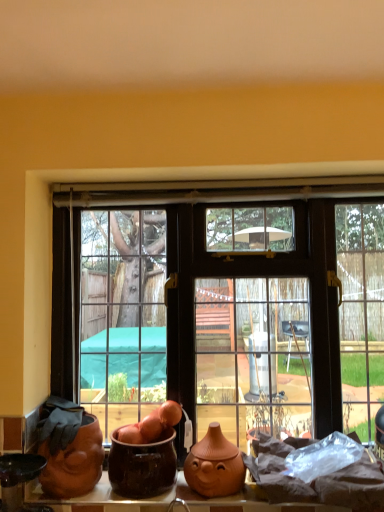
Measure the distance between point (146,446) and camera.

The depth of point (146,446) is 4.24 feet.

What do you see at coordinates (214, 465) in the screenshot? I see `matte orange clay vase at center, which appears as the 1th pottery when viewed from the right` at bounding box center [214, 465].

Identify the location of matte orange clay vase at center, which appears as the 1th pottery when viewed from the right. (214, 465).

The width and height of the screenshot is (384, 512). Identify the location of matte glass window at center. (235, 312).

From a real-world perspective, who is located lower, brown glazed pot at center, positioned as the 2th pottery in left-to-right order, or matte terracotta pot at lower left, which appears as the 1th pottery when viewed from the left?

In real-world perspective, brown glazed pot at center, positioned as the 2th pottery in left-to-right order, is lower.

Is point (160, 450) farther from camera compared to point (46, 468)?

Yes, point (160, 450) is behind point (46, 468).

Considering the relative sizes of brown glazed pot at center, the 2th pottery when ordered from right to left, and matte terracotta pot at lower left, arranged as the third pottery when viewed from the right, in the image provided, is brown glazed pot at center, the 2th pottery when ordered from right to left, thinner than matte terracotta pot at lower left, arranged as the third pottery when viewed from the right,?

Yes.

Consider the image. Which is farther, (194, 482) or (176, 210)?

The point (176, 210) is farther.

Between matte orange clay vase at center, the third pottery when ordered from left to right, and matte glass window at center, which one appears on the left side from the viewer's perspective?

matte orange clay vase at center, the third pottery when ordered from left to right.

Would you say matte orange clay vase at center, the third pottery when ordered from left to right, is outside matte glass window at center?

Absolutely, matte orange clay vase at center, the third pottery when ordered from left to right, is external to matte glass window at center.

Is matte terracotta pot at lower left, which appears as the 1th pottery when viewed from the left, shorter than matte glass window at center?

Yes.

From the image's perspective, between matte terracotta pot at lower left, which appears as the 1th pottery when viewed from the left, and matte glass window at center, who is located below?

matte terracotta pot at lower left, which appears as the 1th pottery when viewed from the left, from the image's perspective.

Does point (45, 444) come in front of point (357, 406)?

Yes, it is in front of point (357, 406).

In terms of size, does matte terracotta pot at lower left, arranged as the third pottery when viewed from the right, appear bigger or smaller than matte glass window at center?

matte terracotta pot at lower left, arranged as the third pottery when viewed from the right, is smaller than matte glass window at center.

Is brown glazed pot at center, positioned as the 2th pottery in left-to-right order, at the back of matte terracotta pot at lower left, arranged as the third pottery when viewed from the right?

No, matte terracotta pot at lower left, arranged as the third pottery when viewed from the right, is not facing the opposite direction of brown glazed pot at center, positioned as the 2th pottery in left-to-right order.

Which object is wider, matte terracotta pot at lower left, arranged as the third pottery when viewed from the right, or brown glazed pot at center, positioned as the 2th pottery in left-to-right order?

With larger width is matte terracotta pot at lower left, arranged as the third pottery when viewed from the right.

You are a GUI agent. You are given a task and a screenshot of the screen. Output one action in this format:
    pyautogui.click(x=<x>, y=<y>)
    Task: Click on the pottery that is in front of the matte terracotta pot at lower left, which appears as the 1th pottery when viewed from the left
    
    Given the screenshot: What is the action you would take?
    [143, 466]

Based on the photo, is matte terracotta pot at lower left, which appears as the 1th pottery when viewed from the left, placed right next to brown glazed pot at center, the 2th pottery when ordered from right to left?

No, matte terracotta pot at lower left, which appears as the 1th pottery when viewed from the left, is not beside brown glazed pot at center, the 2th pottery when ordered from right to left.

Consider the image. Is matte glass window at center looking in the opposite direction of brown glazed pot at center, positioned as the 2th pottery in left-to-right order?

Yes, brown glazed pot at center, positioned as the 2th pottery in left-to-right order, is at the back of matte glass window at center.

Considering the positions of objects matte glass window at center and brown glazed pot at center, positioned as the 2th pottery in left-to-right order, in the image provided, who is more to the right, matte glass window at center or brown glazed pot at center, positioned as the 2th pottery in left-to-right order,?

matte glass window at center is more to the right.

Is matte glass window at center in front of or behind brown glazed pot at center, the 2th pottery when ordered from right to left, in the image?

In the image, matte glass window at center appears behind brown glazed pot at center, the 2th pottery when ordered from right to left.

From a real-world perspective, which is physically below, matte glass window at center or brown glazed pot at center, the 2th pottery when ordered from right to left?

brown glazed pot at center, the 2th pottery when ordered from right to left, is physically lower.

You are a GUI agent. You are given a task and a screenshot of the screen. Output one action in this format:
    pyautogui.click(x=<x>, y=<y>)
    Task: Click on the 3rd pottery to the left of the matte glass window at center, starting your count from the anchor
    Image resolution: width=384 pixels, height=512 pixels.
    Given the screenshot: What is the action you would take?
    pyautogui.click(x=74, y=462)

Which object is further away from the camera taking this photo, matte glass window at center or matte terracotta pot at lower left, arranged as the third pottery when viewed from the right?

matte glass window at center is further away from the camera.

Does matte glass window at center have a larger size compared to matte terracotta pot at lower left, arranged as the third pottery when viewed from the right?

Indeed, matte glass window at center has a larger size compared to matte terracotta pot at lower left, arranged as the third pottery when viewed from the right.

Could you measure the distance between matte glass window at center and matte terracotta pot at lower left, which appears as the 1th pottery when viewed from the left?

The distance of matte glass window at center from matte terracotta pot at lower left, which appears as the 1th pottery when viewed from the left, is 3.76 meters.

Is brown glazed pot at center, the 2th pottery when ordered from right to left, not within matte orange clay vase at center, the third pottery when ordered from left to right?

brown glazed pot at center, the 2th pottery when ordered from right to left, lies outside matte orange clay vase at center, the third pottery when ordered from left to right,'s area.

Is brown glazed pot at center, the 2th pottery when ordered from right to left, taller than matte orange clay vase at center, which appears as the 1th pottery when viewed from the right?

Correct, brown glazed pot at center, the 2th pottery when ordered from right to left, is much taller as matte orange clay vase at center, which appears as the 1th pottery when viewed from the right.

From the image's perspective, which is above, brown glazed pot at center, the 2th pottery when ordered from right to left, or matte orange clay vase at center, which appears as the 1th pottery when viewed from the right?

brown glazed pot at center, the 2th pottery when ordered from right to left, is shown above in the image.

In the scene shown: Could you tell me if brown glazed pot at center, positioned as the 2th pottery in left-to-right order, is facing matte orange clay vase at center, which appears as the 1th pottery when viewed from the right?

No, brown glazed pot at center, positioned as the 2th pottery in left-to-right order, is not oriented towards matte orange clay vase at center, which appears as the 1th pottery when viewed from the right.

At what (x,y) coordinates should I click in order to perform the action: click on pottery that appears in front of the matte terracotta pot at lower left, arranged as the third pottery when viewed from the right. Please return your answer as a coordinate pair (x, y). This screenshot has width=384, height=512. Looking at the image, I should click on (143, 466).

You are a GUI agent. You are given a task and a screenshot of the screen. Output one action in this format:
    pyautogui.click(x=<x>, y=<y>)
    Task: Click on the window on the right of matte orange clay vase at center, the third pottery when ordered from left to right
    The height and width of the screenshot is (512, 384).
    Given the screenshot: What is the action you would take?
    coord(235,312)

Estimate the real-world distances between objects in this image. Which object is further from matte orange clay vase at center, which appears as the 1th pottery when viewed from the right, matte glass window at center or brown glazed pot at center, the 2th pottery when ordered from right to left?

matte glass window at center is further to matte orange clay vase at center, which appears as the 1th pottery when viewed from the right.

Based on their spatial positions, is matte glass window at center or matte terracotta pot at lower left, which appears as the 1th pottery when viewed from the left, further from matte orange clay vase at center, which appears as the 1th pottery when viewed from the right?

Based on the image, matte glass window at center appears to be further to matte orange clay vase at center, which appears as the 1th pottery when viewed from the right.

Estimate the real-world distances between objects in this image. Which object is further from matte orange clay vase at center, the third pottery when ordered from left to right, matte terracotta pot at lower left, arranged as the third pottery when viewed from the right, or matte glass window at center?

matte glass window at center is further to matte orange clay vase at center, the third pottery when ordered from left to right.

From the image, which object appears to be farther from matte orange clay vase at center, which appears as the 1th pottery when viewed from the right, brown glazed pot at center, the 2th pottery when ordered from right to left, or matte terracotta pot at lower left, which appears as the 1th pottery when viewed from the left?

matte terracotta pot at lower left, which appears as the 1th pottery when viewed from the left, lies further to matte orange clay vase at center, which appears as the 1th pottery when viewed from the right, than the other object.

Which object lies nearer to the anchor point matte glass window at center, matte orange clay vase at center, which appears as the 1th pottery when viewed from the right, or matte terracotta pot at lower left, arranged as the third pottery when viewed from the right?

matte orange clay vase at center, which appears as the 1th pottery when viewed from the right, is positioned closer to the anchor matte glass window at center.

Based on their spatial positions, is brown glazed pot at center, the 2th pottery when ordered from right to left, or matte terracotta pot at lower left, which appears as the 1th pottery when viewed from the left, closer to matte glass window at center?

brown glazed pot at center, the 2th pottery when ordered from right to left, is closer to matte glass window at center.

Based on their spatial positions, is matte glass window at center or matte orange clay vase at center, the third pottery when ordered from left to right, further from matte terracotta pot at lower left, which appears as the 1th pottery when viewed from the left?

The object further to matte terracotta pot at lower left, which appears as the 1th pottery when viewed from the left, is matte glass window at center.

Looking at the image, which one is located further to matte terracotta pot at lower left, arranged as the third pottery when viewed from the right, matte glass window at center or brown glazed pot at center, positioned as the 2th pottery in left-to-right order?

matte glass window at center lies further to matte terracotta pot at lower left, arranged as the third pottery when viewed from the right, than the other object.

Locate an element on the screen. The image size is (384, 512). pottery situated between matte terracotta pot at lower left, arranged as the third pottery when viewed from the right, and matte orange clay vase at center, the third pottery when ordered from left to right, from left to right is located at coordinates (143, 466).